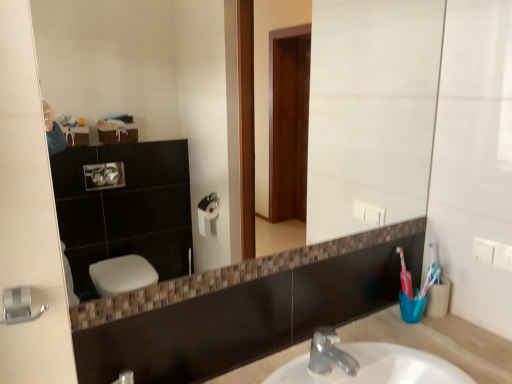
Where is `vacant region above beige marble sink at center (from a real-world perspective)`? vacant region above beige marble sink at center (from a real-world perspective) is located at coordinates (403, 350).